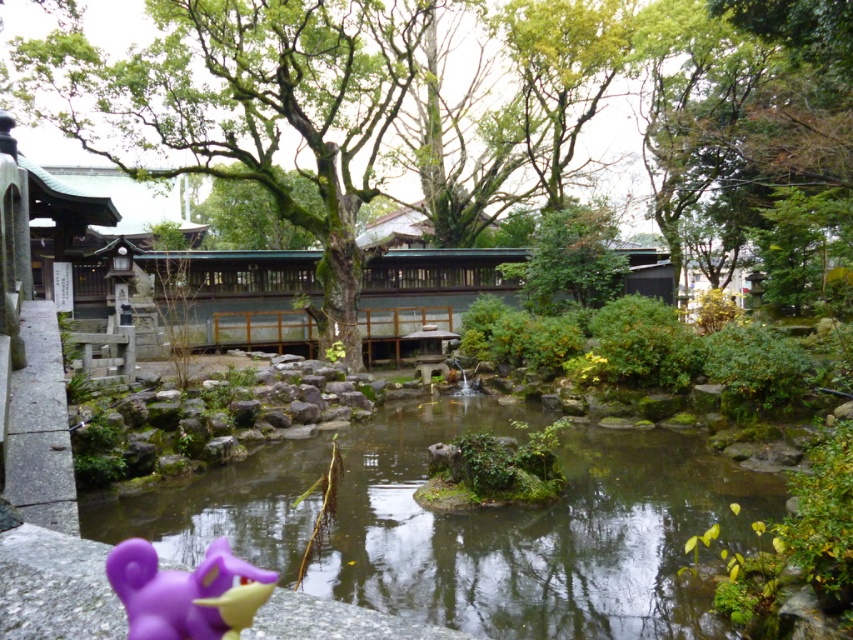
I want to click on green mossy tree at center, so click(238, 88).

Who is positioned more to the left, green mossy tree at center or purple matte toy at lower left?

purple matte toy at lower left is more to the left.

What are the coordinates of `green mossy tree at center` in the screenshot? It's located at (238, 88).

Identify the location of green mossy tree at center. The width and height of the screenshot is (853, 640). (238, 88).

Who is lower down, clear water stream at center or purple matte toy at lower left?

clear water stream at center is lower down.

In the scene shown: Is clear water stream at center bigger than purple matte toy at lower left?

Indeed, clear water stream at center has a larger size compared to purple matte toy at lower left.

What do you see at coordinates (537, 531) in the screenshot?
I see `clear water stream at center` at bounding box center [537, 531].

Where is `clear water stream at center`? clear water stream at center is located at coordinates (537, 531).

Is the position of green mossy tree at center more distant than that of clear water stream at center?

Yes, green mossy tree at center is behind clear water stream at center.

Consider the image. Between green mossy tree at center and clear water stream at center, which one appears on the left side from the viewer's perspective?

clear water stream at center is more to the left.

At what (x,y) coordinates should I click in order to perform the action: click on green mossy tree at center. Please return your answer as a coordinate pair (x, y). This screenshot has width=853, height=640. Looking at the image, I should click on (238, 88).